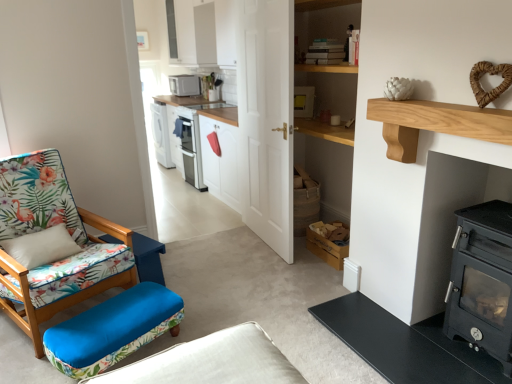
Locate an element on the screen. This screenshot has width=512, height=384. free point above light brown wood at upper right (from a real-world perspective) is located at coordinates (450, 104).